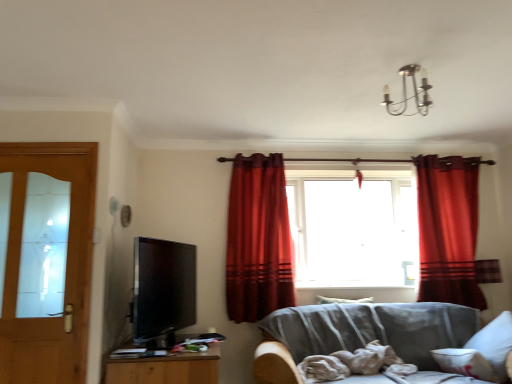
Image resolution: width=512 pixels, height=384 pixels. In order to click on transparent glass window at center in this screenshot , I will do `click(353, 230)`.

What is the approximate height of wooden cabinet at lower left?

It is 16.19 inches.

Where is `matte black tv at left`? Image resolution: width=512 pixels, height=384 pixels. matte black tv at left is located at coordinates pos(163,291).

What's the angular difference between light brown wooden door at left and satin red curtain at right, marked as the 1th curtain in a right-to-left arrangement,'s facing directions?

The facing directions of light brown wooden door at left and satin red curtain at right, marked as the 1th curtain in a right-to-left arrangement, are 0.598 degrees apart.

Looking at this image, is light brown wooden door at left taller than satin red curtain at right, marked as the 1th curtain in a right-to-left arrangement?

Yes, light brown wooden door at left is taller than satin red curtain at right, marked as the 1th curtain in a right-to-left arrangement.

Is light brown wooden door at left oriented away from satin red curtain at right, placed as the second curtain when sorted from left to right?

No, light brown wooden door at left is not facing the opposite direction of satin red curtain at right, placed as the second curtain when sorted from left to right.

Consider the image. From the image's perspective, is light brown wooden door at left beneath satin red curtain at right, marked as the 1th curtain in a right-to-left arrangement?

Correct, light brown wooden door at left appears lower than satin red curtain at right, marked as the 1th curtain in a right-to-left arrangement, in the image.

Is transparent glass window at center next to satin red curtain at right, marked as the 1th curtain in a right-to-left arrangement, and touching it?

No, transparent glass window at center is not with satin red curtain at right, marked as the 1th curtain in a right-to-left arrangement.

From the image's perspective, which one is positioned higher, transparent glass window at center or satin red curtain at right, marked as the 1th curtain in a right-to-left arrangement?

transparent glass window at center.

Considering the relative sizes of transparent glass window at center and satin red curtain at right, placed as the second curtain when sorted from left to right, in the image provided, is transparent glass window at center thinner than satin red curtain at right, placed as the second curtain when sorted from left to right,?

Incorrect, the width of transparent glass window at center is not less than that of satin red curtain at right, placed as the second curtain when sorted from left to right.

From a real-world perspective, which is physically above, transparent glass window at center or satin red curtain at right, marked as the 1th curtain in a right-to-left arrangement?

transparent glass window at center, from a real-world perspective.

From a real-world perspective, is white soft pillow at center, acting as the 1th pillow starting from the back, on velvet red curtain at center, the 2th curtain from the right?

No.

Which of these two, white soft pillow at center, which ranks as the second pillow in bottom-to-top order, or velvet red curtain at center, the 2th curtain from the right, is smaller?

white soft pillow at center, which ranks as the second pillow in bottom-to-top order, is smaller.

Which is closer, (348,302) or (269,276)?

The point (269,276) is in front.

Who is shorter, white soft pillow at center, acting as the 1th pillow starting from the back, or velvet red curtain at center, positioned as the 1th curtain in left-to-right order?

white soft pillow at center, acting as the 1th pillow starting from the back.

Considering the relative sizes of white soft pillow at lower right, which is counted as the first pillow, starting from the front, and light brown wooden door at left in the image provided, is white soft pillow at lower right, which is counted as the first pillow, starting from the front, wider than light brown wooden door at left?

Indeed, white soft pillow at lower right, which is counted as the first pillow, starting from the front, has a greater width compared to light brown wooden door at left.

Is white soft pillow at lower right, which is counted as the first pillow, starting from the front, in front of or behind light brown wooden door at left in the image?

Visually, white soft pillow at lower right, which is counted as the first pillow, starting from the front, is located in front of light brown wooden door at left.

What's the angular difference between velvet red curtain at center, positioned as the 1th curtain in left-to-right order, and white soft pillow at lower right, the second pillow positioned from the left,'s facing directions?

velvet red curtain at center, positioned as the 1th curtain in left-to-right order, and white soft pillow at lower right, the second pillow positioned from the left, are facing 104 degrees away from each other.

From a real-world perspective, starting from the white soft pillow at lower right, the 1th pillow viewed from the right, which curtain is the 1st one vertically above it? Please provide its 2D coordinates.

[(258, 239)]

Considering the positions of objects velvet red curtain at center, the 2th curtain from the right, and white soft pillow at lower right, the second pillow viewed from the back, in the image provided, who is behind, velvet red curtain at center, the 2th curtain from the right, or white soft pillow at lower right, the second pillow viewed from the back,?

velvet red curtain at center, the 2th curtain from the right, is further away from the camera.

Which object is positioned more to the right, velvet red curtain at center, the 2th curtain from the right, or white soft pillow at lower right, the 1th pillow viewed from the right?

white soft pillow at lower right, the 1th pillow viewed from the right, is more to the right.

Is point (134, 329) positioned behind point (385, 92)?

No, (134, 329) is closer to viewer.

Is matte black tv at left surrounding chrome metallic chandelier at upper center?

That's incorrect, chrome metallic chandelier at upper center is not inside matte black tv at left.

From the image's perspective, is matte black tv at left above or below chrome metallic chandelier at upper center?

Based on their image positions, matte black tv at left is located beneath chrome metallic chandelier at upper center.

Which of these two, matte black tv at left or chrome metallic chandelier at upper center, stands taller?

matte black tv at left is taller.

Is velvet red curtain at center, positioned as the 1th curtain in left-to-right order, completely or partially outside of light brown wooden door at left?

Yes, velvet red curtain at center, positioned as the 1th curtain in left-to-right order, is outside of light brown wooden door at left.

How many degrees apart are the facing directions of velvet red curtain at center, positioned as the 1th curtain in left-to-right order, and light brown wooden door at left?

velvet red curtain at center, positioned as the 1th curtain in left-to-right order, and light brown wooden door at left are facing 0.847 degrees away from each other.

From a real-world perspective, who is located higher, velvet red curtain at center, the 2th curtain from the right, or light brown wooden door at left?

velvet red curtain at center, the 2th curtain from the right, from a real-world perspective.

In terms of size, does velvet red curtain at center, the 2th curtain from the right, appear bigger or smaller than light brown wooden door at left?

Clearly, velvet red curtain at center, the 2th curtain from the right, is larger in size than light brown wooden door at left.

You are a GUI agent. You are given a task and a screenshot of the screen. Output one action in this format:
    pyautogui.click(x=<x>, y=<y>)
    Task: Click on the door below the satin red curtain at right, placed as the second curtain when sorted from left to right (from the image's perspective)
    This screenshot has height=384, width=512.
    Given the screenshot: What is the action you would take?
    pyautogui.click(x=45, y=262)

Find the location of a particular element. This screenshot has height=384, width=512. window on the left of satin red curtain at right, placed as the second curtain when sorted from left to right is located at coordinates (353, 230).

When comparing their distances from transparent glass window at center, does velvet red curtain at center, positioned as the 1th curtain in left-to-right order, or matte black tv at left seem further?

matte black tv at left is positioned further to the anchor transparent glass window at center.

Considering their positions, is transparent glass window at center positioned closer to light brown wooden door at left than white soft pillow at center, positioned as the first pillow in top-to-bottom order?

The object closer to light brown wooden door at left is white soft pillow at center, positioned as the first pillow in top-to-bottom order.

Considering their positions, is light brown wooden door at left positioned closer to velvet red curtain at center, positioned as the 1th curtain in left-to-right order, than white soft pillow at center, positioned as the first pillow in top-to-bottom order?

The object closer to velvet red curtain at center, positioned as the 1th curtain in left-to-right order, is white soft pillow at center, positioned as the first pillow in top-to-bottom order.

Estimate the real-world distances between objects in this image. Which object is closer to satin red curtain at right, marked as the 1th curtain in a right-to-left arrangement, chrome metallic chandelier at upper center or matte black tv at left?

chrome metallic chandelier at upper center lies closer to satin red curtain at right, marked as the 1th curtain in a right-to-left arrangement, than the other object.

Which object lies further to the anchor point chrome metallic chandelier at upper center, satin red curtain at right, placed as the second curtain when sorted from left to right, or gray fabric couch at lower right?

gray fabric couch at lower right.

Looking at the image, which one is located closer to gray fabric couch at lower right, transparent glass window at center or matte black tv at left?

transparent glass window at center lies closer to gray fabric couch at lower right than the other object.

Estimate the real-world distances between objects in this image. Which object is further from velvet red curtain at center, the 2th curtain from the right, white soft pillow at lower right, which is counted as the first pillow, starting from the front, or transparent glass window at center?

white soft pillow at lower right, which is counted as the first pillow, starting from the front, lies further to velvet red curtain at center, the 2th curtain from the right, than the other object.

Based on their spatial positions, is chrome metallic chandelier at upper center or white soft pillow at lower right, the second pillow positioned from the left, closer to gray fabric couch at lower right?

The object closer to gray fabric couch at lower right is white soft pillow at lower right, the second pillow positioned from the left.

You are a GUI agent. You are given a task and a screenshot of the screen. Output one action in this format:
    pyautogui.click(x=<x>, y=<y>)
    Task: Click on the cabinetry between matte black tv at left and gray fabric couch at lower right
    The image size is (512, 384).
    Given the screenshot: What is the action you would take?
    pyautogui.click(x=166, y=369)

Identify the location of window between velvet red curtain at center, positioned as the 1th curtain in left-to-right order, and satin red curtain at right, placed as the second curtain when sorted from left to right, in the horizontal direction. This screenshot has height=384, width=512. (353, 230).

Where is `studio couch between chrome metallic chandelier at upper center and wooden cabinet at lower left in the vertical direction`? The width and height of the screenshot is (512, 384). studio couch between chrome metallic chandelier at upper center and wooden cabinet at lower left in the vertical direction is located at coordinates (360, 333).

The height and width of the screenshot is (384, 512). I want to click on lamp between wooden cabinet at lower left and white soft pillow at lower right, which appears as the 1th pillow when ordered from the bottom, from left to right, so click(x=406, y=93).